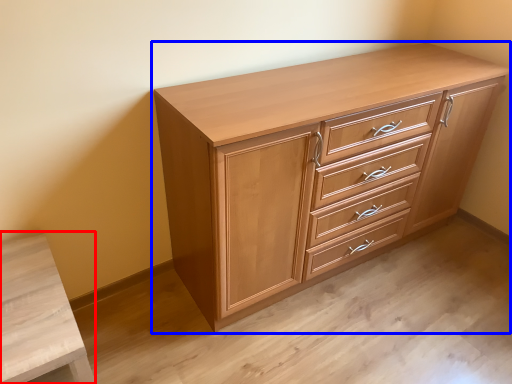
Question: Which object is further to the camera taking this photo, vanity (highlighted by a red box) or chest of drawers (highlighted by a blue box)?

Choices:
 (A) vanity
 (B) chest of drawers

Answer: (B)